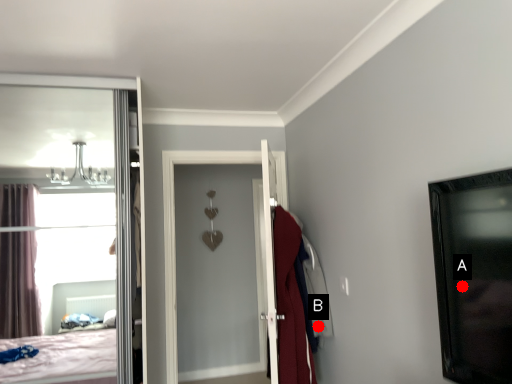
Question: Two points are circled on the image, labeled by A and B beside each circle. Among these points, which one is farthest from the camera?

Choices:
 (A) A is further
 (B) B is further

Answer: (B)